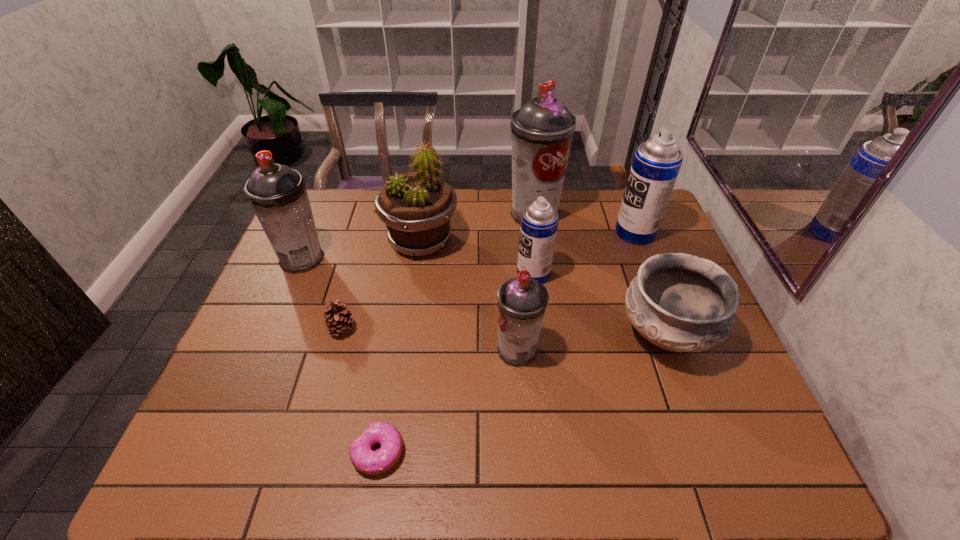
Find the location of a particular element. This screenshot has height=540, width=960. the biggest gray aerosol can is located at coordinates (542, 130).

At what (x,y) coordinates should I click in order to perform the action: click on the tallest object. Please return your answer as a coordinate pair (x, y). This screenshot has height=540, width=960. Looking at the image, I should click on (542, 130).

I want to click on the bigger blue aerosol can, so click(x=656, y=163).

Where is `the right blue aerosol can`? This screenshot has height=540, width=960. the right blue aerosol can is located at coordinates (656, 163).

Locate an element on the screen. the second nearest gray aerosol can is located at coordinates (278, 195).

Where is `the leftmost object`? the leftmost object is located at coordinates (278, 195).

Where is `flowerpot`? The height and width of the screenshot is (540, 960). flowerpot is located at coordinates (416, 207).

At what (x,y) coordinates should I click in order to perform the action: click on the smaller blue aerosol can. Please return your answer as a coordinate pair (x, y). This screenshot has height=540, width=960. Looking at the image, I should click on (539, 221).

Locate an element on the screen. the left blue aerosol can is located at coordinates (539, 221).

Find the location of a particular element. The width and height of the screenshot is (960, 540). the nearest aerosol can is located at coordinates (522, 301).